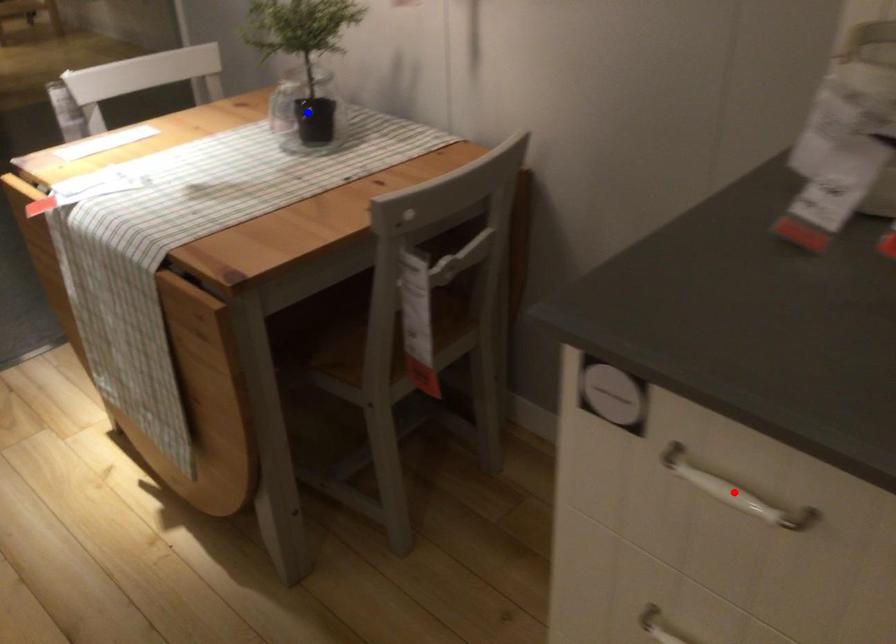
Question: In the image, two points are highlighted. Which point is nearer to the camera? Reply with the corresponding letter.

Choices:
 (A) blue point
 (B) red point

Answer: (B)